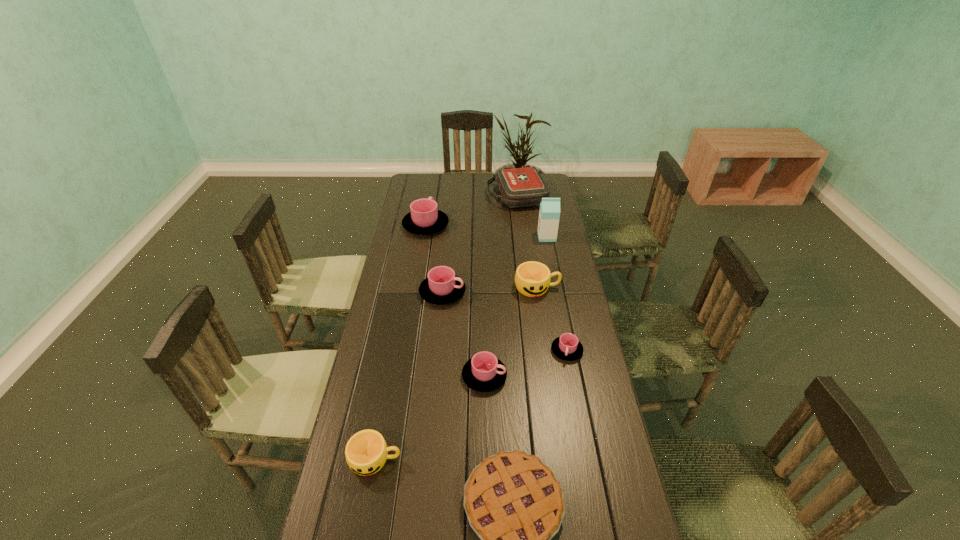
At what (x,y) coordinates should I click in order to perform the action: click on vacant space at the right edge. Please return your answer as a coordinate pair (x, y). Image resolution: width=960 pixels, height=540 pixels. Looking at the image, I should click on (532, 242).

This screenshot has height=540, width=960. In the image, there is a desktop. What are the coordinates of `free space at the far left corner` in the screenshot? It's located at (422, 193).

At what (x,y) coordinates should I click in order to perform the action: click on vacant space in between the farther beige cup and the farthest cup. Please return your answer as a coordinate pair (x, y). Looking at the image, I should click on click(482, 256).

At what (x,y) coordinates should I click in order to perform the action: click on vacant area that lies between the farthest object and the nearer beige cup. Please return your answer as a coordinate pair (x, y). Looking at the image, I should click on (446, 328).

Where is `empty space that is in between the third biggest pink cup and the shortest cup`? Image resolution: width=960 pixels, height=540 pixels. empty space that is in between the third biggest pink cup and the shortest cup is located at coordinates (526, 363).

The image size is (960, 540). Identify the location of empty space that is in between the tallest object and the second smallest pink cup. (516, 306).

Identify which object is the seventh closest to the bigger beige cup. Please provide its 2D coordinates. Your answer should be formatted as a tuple, i.e. [(x, y)], where the tuple contains the x and y coordinates of a point satisfying the conditions above.

[(514, 503)]

Locate which object is the third closest to the milk carton. Please provide its 2D coordinates. Your answer should be formatted as a tuple, i.e. [(x, y)], where the tuple contains the x and y coordinates of a point satisfying the conditions above.

[(442, 286)]

Identify which cup is the sixth closest to the first-aid kit. Please provide its 2D coordinates. Your answer should be formatted as a tuple, i.e. [(x, y)], where the tuple contains the x and y coordinates of a point satisfying the conditions above.

[(366, 452)]

Select which cup appears as the fourth closest to the farther beige cup. Please provide its 2D coordinates. Your answer should be formatted as a tuple, i.e. [(x, y)], where the tuple contains the x and y coordinates of a point satisfying the conditions above.

[(424, 218)]